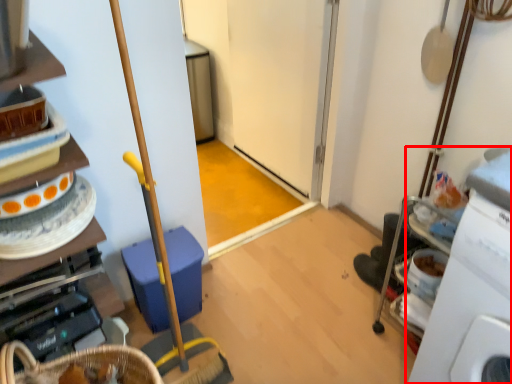
Question: From the image's perspective, what is the correct spatial positioning of machine (annotated by the red box) in reference to cabinetry?

Choices:
 (A) above
 (B) below

Answer: (B)